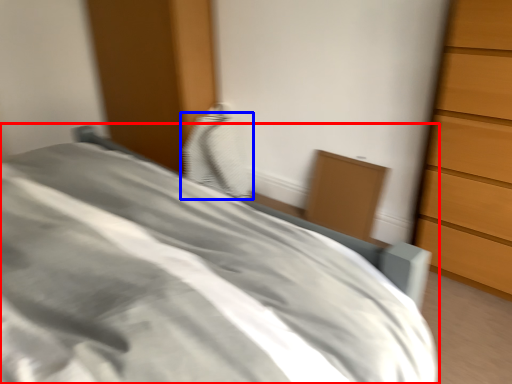
Question: Among these objects, which one is farthest to the camera, bed (highlighted by a red box) or pillow (highlighted by a blue box)?

Choices:
 (A) bed
 (B) pillow

Answer: (B)